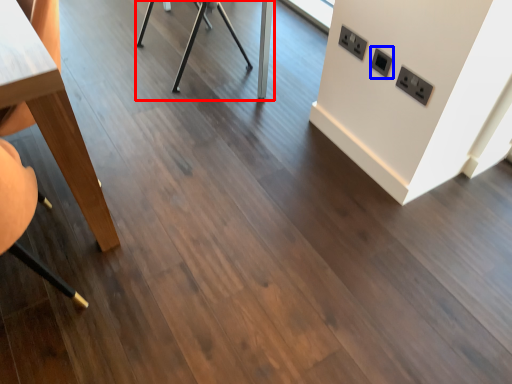
Question: Which object appears closest to the camera in this image, table (highlighted by a red box) or electric outlet (highlighted by a blue box)?

Choices:
 (A) table
 (B) electric outlet

Answer: (B)